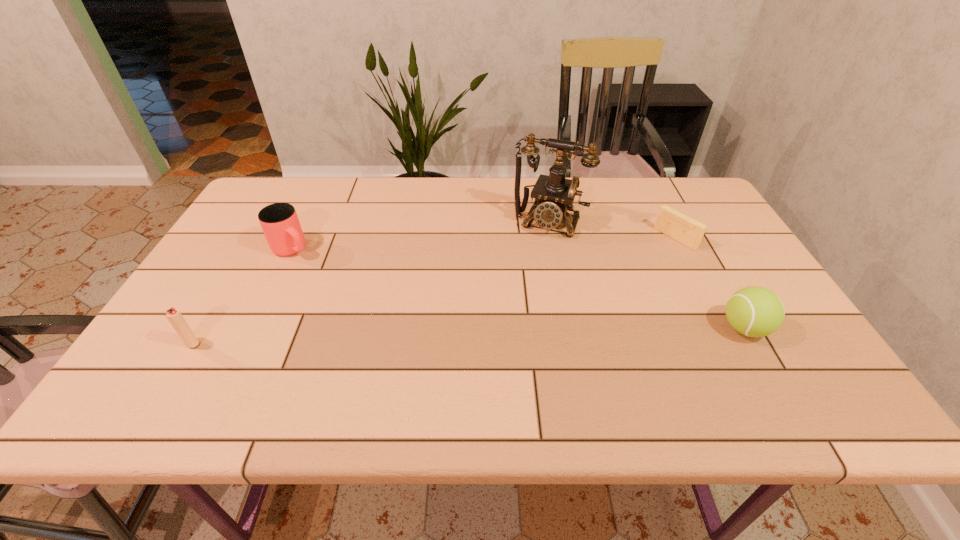
I want to click on free space between the tennis ball and the shortest object, so click(709, 283).

I want to click on unoccupied position between the third object from right to left and the tennis ball, so click(646, 275).

Select which object is the third closest to the cup. Please provide its 2D coordinates. Your answer should be formatted as a tuple, i.e. [(x, y)], where the tuple contains the x and y coordinates of a point satisfying the conditions above.

[(671, 222)]

Point out which object is positioned as the third nearest to the cup. Please provide its 2D coordinates. Your answer should be formatted as a tuple, i.e. [(x, y)], where the tuple contains the x and y coordinates of a point satisfying the conditions above.

[(671, 222)]

This screenshot has width=960, height=540. I want to click on free point that satisfies the following two spatial constraints: 1. on the back side of the leftmost object; 2. on the right side of the third object from left to right, so click(x=265, y=222).

Locate an element on the screen. free space that satisfies the following two spatial constraints: 1. on the front side of the tennis ball; 2. on the left side of the telephone is located at coordinates (569, 328).